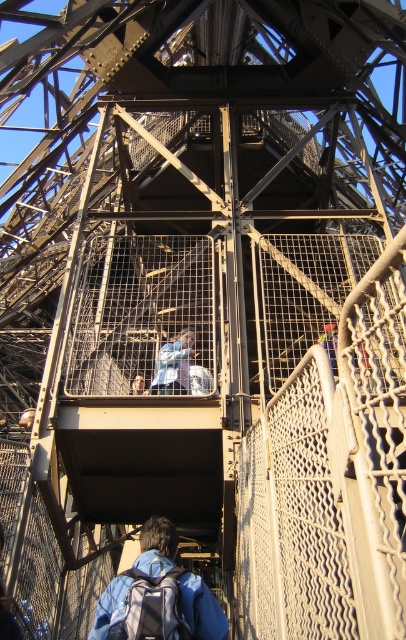
Question: Which point is farther to the camera?

Choices:
 (A) light blue fabric at center
 (B) matte blue backpack at lower center
 (C) blue fabric backpack at lower center

Answer: (A)

Question: Can you confirm if blue fabric backpack at lower center is bigger than matte blue backpack at lower center?

Choices:
 (A) yes
 (B) no

Answer: (A)

Question: Which point is farther to the camera?

Choices:
 (A) matte blue backpack at lower center
 (B) blue fabric backpack at lower center

Answer: (B)

Question: From the image, what is the correct spatial relationship of blue fabric backpack at lower center in relation to matte blue backpack at lower center?

Choices:
 (A) left
 (B) right

Answer: (B)

Question: Can you confirm if matte blue backpack at lower center is positioned to the right of light blue fabric at center?

Choices:
 (A) no
 (B) yes

Answer: (B)

Question: Which point is closer to the camera?

Choices:
 (A) (166, 365)
 (B) (133, 620)

Answer: (B)